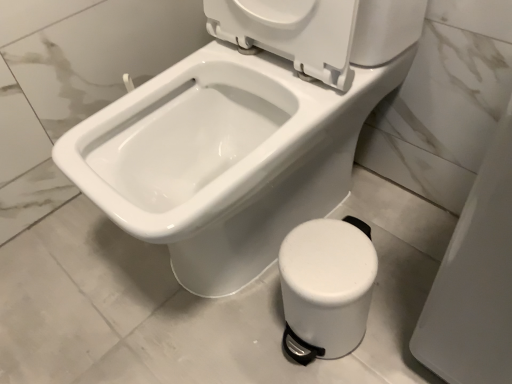
Question: Considering the positions of white plastic pedal bin at lower right and white glossy bidet at center in the image, is white plastic pedal bin at lower right taller or shorter than white glossy bidet at center?

Choices:
 (A) tall
 (B) short

Answer: (B)

Question: Based on their sizes in the image, would you say white plastic pedal bin at lower right is bigger or smaller than white glossy bidet at center?

Choices:
 (A) small
 (B) big

Answer: (A)

Question: Considering the positions of white plastic pedal bin at lower right and white glossy bidet at center in the image, is white plastic pedal bin at lower right wider or thinner than white glossy bidet at center?

Choices:
 (A) wide
 (B) thin

Answer: (B)

Question: Considering the positions of white glossy bidet at center and white plastic pedal bin at lower right in the image, is white glossy bidet at center wider or thinner than white plastic pedal bin at lower right?

Choices:
 (A) wide
 (B) thin

Answer: (A)

Question: Would you say white glossy bidet at center is to the left or to the right of white plastic pedal bin at lower right in the picture?

Choices:
 (A) right
 (B) left

Answer: (B)

Question: Considering the positions of white glossy bidet at center and white plastic pedal bin at lower right in the image, is white glossy bidet at center taller or shorter than white plastic pedal bin at lower right?

Choices:
 (A) short
 (B) tall

Answer: (B)

Question: Is point (228, 112) positioned closer to the camera than point (308, 273)?

Choices:
 (A) farther
 (B) closer

Answer: (A)